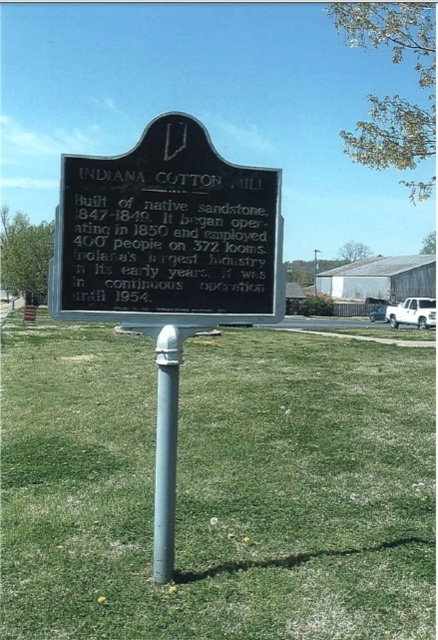
Can you confirm if black sandstone sign at center is smaller than blackmaterial/texturetext at center?

No.

Which is in front, point (271, 209) or point (180, 168)?

Point (180, 168) is in front.

Identify the location of black sandstone sign at center. (166, 260).

Measure the distance between blackmaterial/texturetext at center and silver metallic pole at center.

They are 22.69 inches apart.

Which is more to the left, blackmaterial/texturetext at center or silver metallic pole at center?

Positioned to the left is silver metallic pole at center.

Where is `blackmaterial/texturetext at center`? The image size is (438, 640). blackmaterial/texturetext at center is located at coordinates (168, 236).

The width and height of the screenshot is (438, 640). What are the coordinates of `blackmaterial/texturetext at center` in the screenshot? It's located at (168, 236).

Who is positioned more to the right, green grass at center or silver metallic pole at center?

Positioned to the right is green grass at center.

Is green grass at center shorter than silver metallic pole at center?

Yes, green grass at center is shorter than silver metallic pole at center.

You are a GUI agent. You are given a task and a screenshot of the screen. Output one action in this format:
    pyautogui.click(x=<x>, y=<y>)
    Task: Click on the green grass at center
    
    Given the screenshot: What is the action you would take?
    (x=218, y=488)

Image resolution: width=438 pixels, height=640 pixels. What are the coordinates of `green grass at center` in the screenshot? It's located at (218, 488).